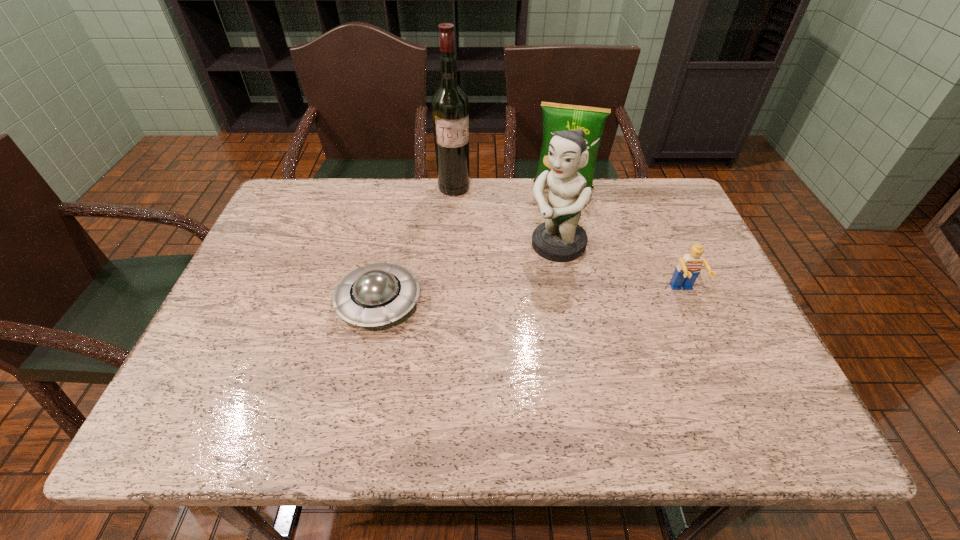
Where is `saucer`? saucer is located at coordinates (374, 295).

Find the location of a particular element. This screenshot has width=960, height=540. the leftmost object is located at coordinates (374, 295).

In order to click on the fourth tallest object in this screenshot , I will do `click(688, 269)`.

The height and width of the screenshot is (540, 960). I want to click on Lego, so click(x=688, y=269).

Where is `figurine`? figurine is located at coordinates (560, 238).

Where is `the third farthest object`? The height and width of the screenshot is (540, 960). the third farthest object is located at coordinates (560, 238).

Locate an element on the screen. The image size is (960, 540). crisp (potato chip) is located at coordinates (556, 117).

In order to click on wine bottle in this screenshot , I will do `click(450, 108)`.

Locate an element on the screen. Image resolution: width=960 pixels, height=540 pixels. the tallest object is located at coordinates (450, 108).

The height and width of the screenshot is (540, 960). In order to click on free point located on the back of the saucer in this screenshot , I will do `click(397, 214)`.